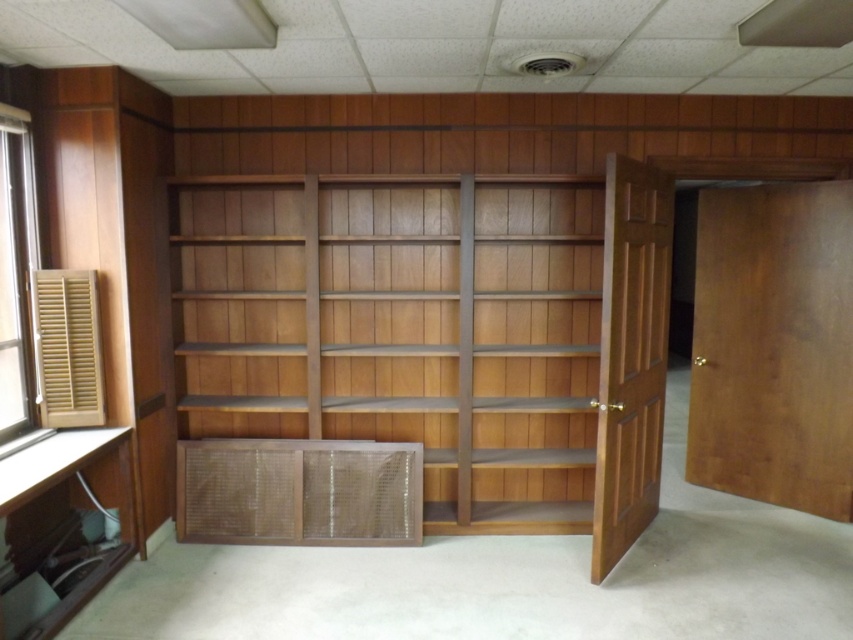
You are an interior designer planning to place a new desk in this office. The desk requires a space that is wider than the shiny brown wood bookshelf at center. Is there enough space next to the wooden slatted window at left to accommodate the desk?

The shiny brown wood bookshelf at center is larger in size than the wooden slatted window at left. Since the desk needs to be wider than the bookshelf, there might not be enough space next to the window as the window is smaller. Therefore, the space next to the wooden slatted window at left may not be sufficient for the desk.

You are standing in the office and want to place a small decorative item between the two points, point (x=374, y=392) and point (x=1, y=339). Considering their positions, which point is closer to you where you should place the item to ensure it is near the front?

Point (x=374, y=392) is further to the viewer than point (x=1, y=339), so you should place the item closer to point (x=374, y=392) to ensure it is near the front.